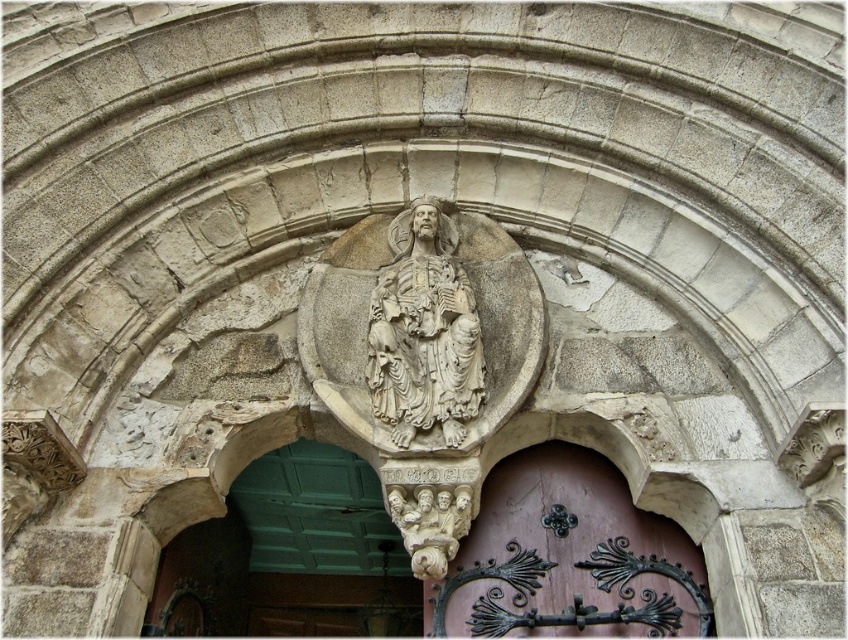
You are an interior designer planning to place a new decorative item in the space. The pink wood door at center and the white stone carving at center are already present. Which object should you avoid placing a large statue next to if you want to maintain a balanced composition?

You should avoid placing the large statue next to the pink wood door at center because it is larger in size than the white stone carving at center, and adding another large item next to it might disrupt the balance.

You are standing in front of the stone archway and want to enter through the opening. Which object, the pink wood door at center or the white stone statue at center, should you pass under to go through the archway?

You should pass under the white stone statue at center because the pink wood door at center is below it, meaning the statue is positioned above the door. To enter the archway, you would go through the door located beneath the statue.